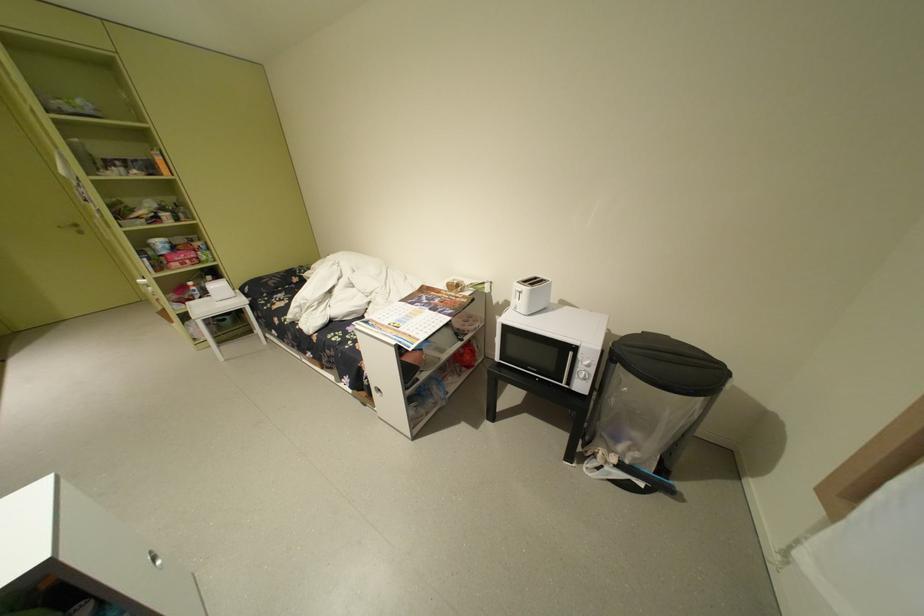
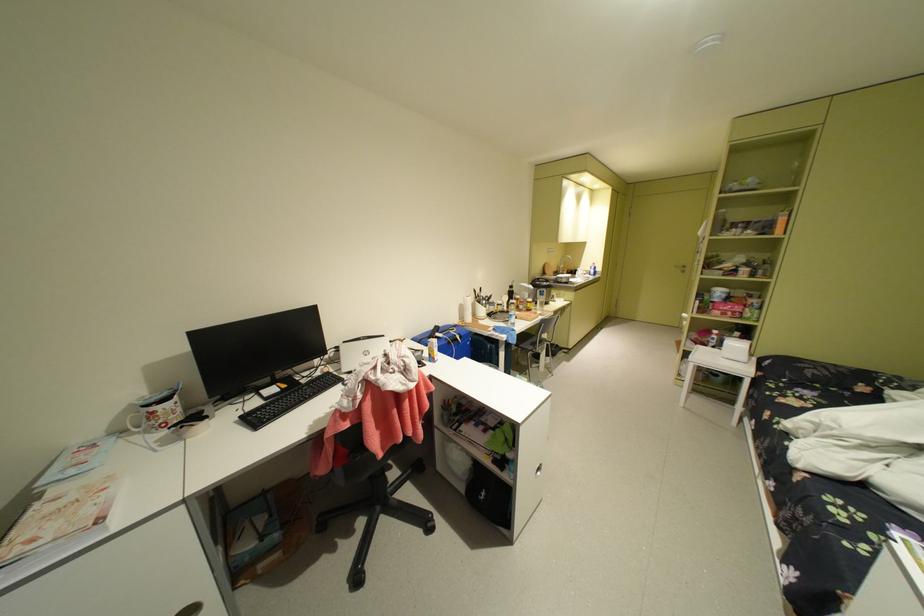
Find the pixel in the second image that matches point (190, 253) in the first image.

(740, 304)